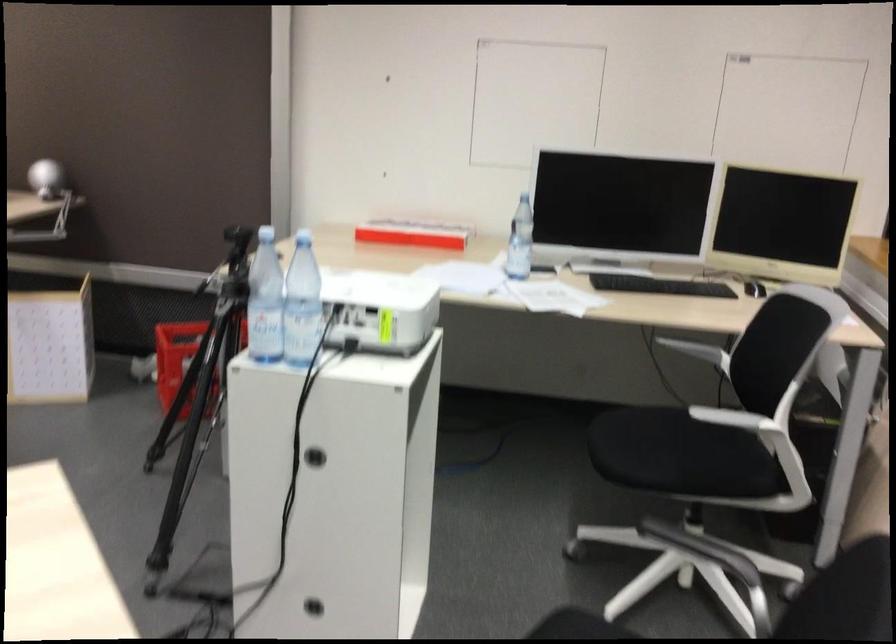
You are a GUI agent. You are given a task and a screenshot of the screen. Output one action in this format:
    pyautogui.click(x=<x>, y=<y>)
    Task: Click on the white chair armrest
    The image size is (896, 644).
    Given the screenshot: What is the action you would take?
    pyautogui.click(x=733, y=418)